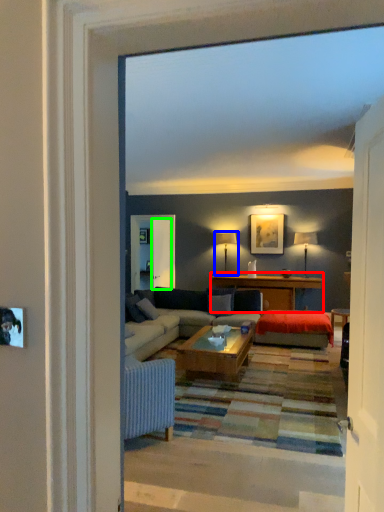
Question: Based on their relative distances, which object is nearer to table (highlighted by a red box)? Choose from lamp (highlighted by a blue box) and screen door (highlighted by a green box).

Choices:
 (A) lamp
 (B) screen door

Answer: (A)